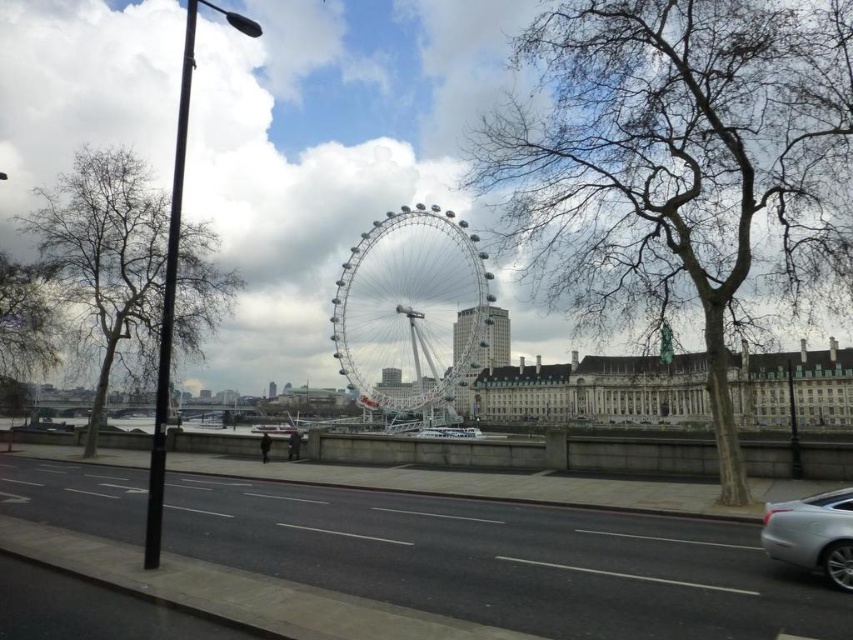
Question: Is bare wood tree at center positioned in front of silver metallic car at lower right?

Choices:
 (A) no
 (B) yes

Answer: (A)

Question: Which point is farther to the camera?

Choices:
 (A) white metallic ferris wheel at center
 (B) bare wood tree at left

Answer: (A)

Question: Does bare wood tree at center have a smaller size compared to bare wood tree at left?

Choices:
 (A) no
 (B) yes

Answer: (B)

Question: Which point is closer to the camera?

Choices:
 (A) metallic silver tower at center
 (B) gray textured tree at left
 (C) silver metallic car at lower right
 (D) bare wood tree at left

Answer: (C)

Question: Does bare wood tree at center have a greater width compared to bare wood tree at left?

Choices:
 (A) no
 (B) yes

Answer: (A)

Question: Estimate the real-world distances between objects in this image. Which object is closer to the silver metallic car at lower right?

Choices:
 (A) white metallic ferris wheel at center
 (B) gray textured tree at left
 (C) bare wood tree at center
 (D) bare wood tree at left

Answer: (C)